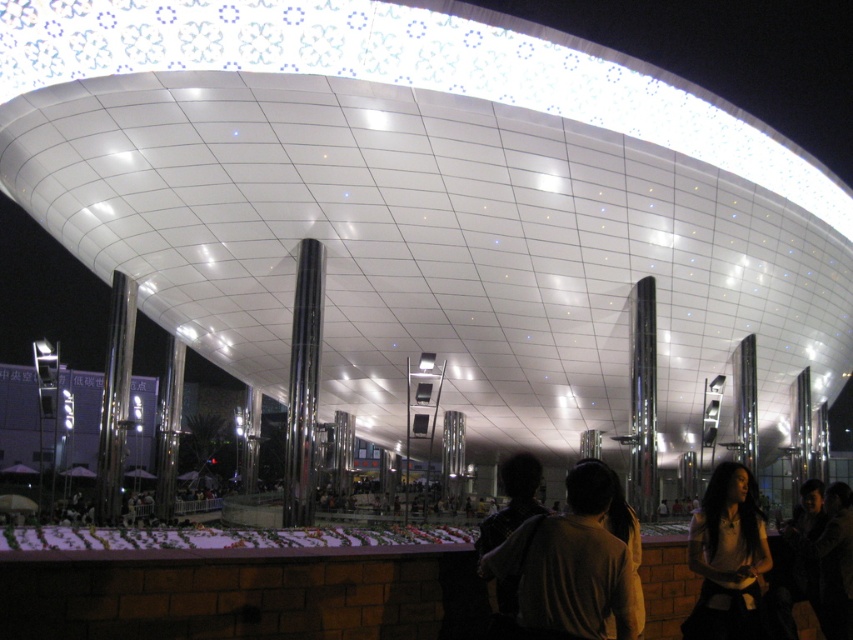
Which of these two, dark brown hair at center or matte white blouse at center, stands taller?

Standing taller between the two is matte white blouse at center.

Is point (595, 593) farther from camera compared to point (746, 604)?

That is False.

You are a GUI agent. You are given a task and a screenshot of the screen. Output one action in this format:
    pyautogui.click(x=<x>, y=<y>)
    Task: Click on the dark brown hair at center
    This screenshot has width=853, height=640.
    Given the screenshot: What is the action you would take?
    pyautogui.click(x=572, y=564)